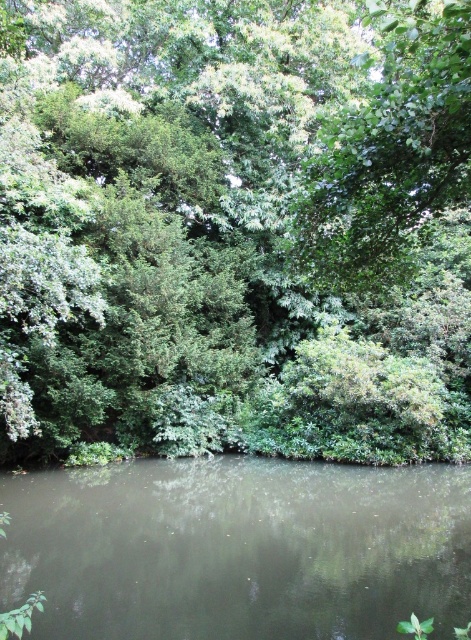
What do you see at coordinates (235, 228) in the screenshot?
I see `green leafy tree at center` at bounding box center [235, 228].

Who is taller, green leafy tree at center or green leafy water at center?

green leafy tree at center is taller.

Where is `green leafy tree at center`? green leafy tree at center is located at coordinates (235, 228).